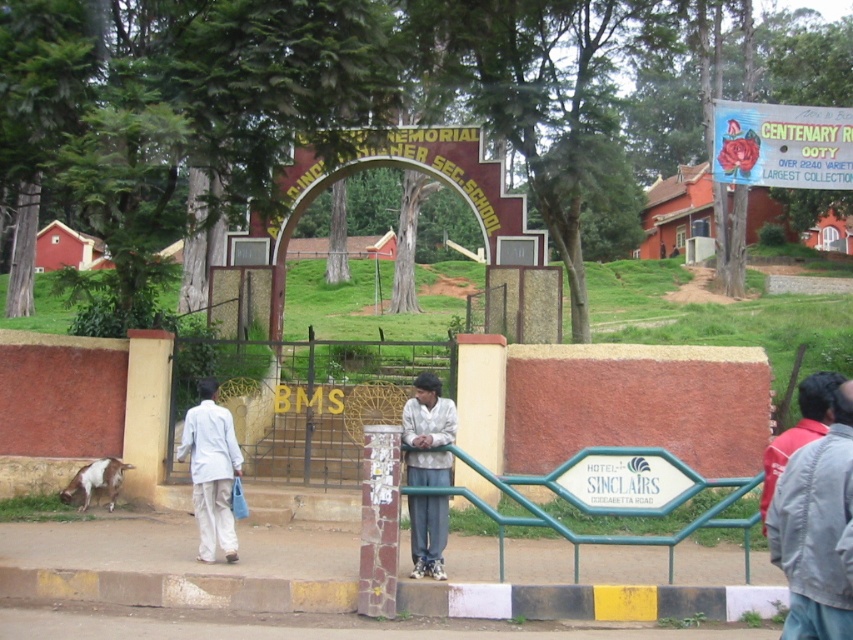
Does light beige fabric pants at center appear under white cotton shirt at left?

Incorrect, light beige fabric pants at center is not positioned below white cotton shirt at left.

Who is more distant from viewer, (424, 397) or (206, 404)?

The point (206, 404) is behind.

Is point (413, 422) closer to camera compared to point (178, 442)?

Yes, it is in front of point (178, 442).

The image size is (853, 640). I want to click on light beige fabric pants at center, so click(428, 433).

Is point (842, 472) positioned before point (195, 448)?

Yes, point (842, 472) is closer to viewer.

Does point (840, 406) come behind point (204, 483)?

No, it is in front of (204, 483).

What do you see at coordinates (816, 529) in the screenshot?
I see `gray fabric jacket at lower right` at bounding box center [816, 529].

Find the location of a particular element. gray fabric jacket at lower right is located at coordinates (816, 529).

Is metallic gate at center further to camera compared to white cotton shirt at left?

Yes, it is behind white cotton shirt at left.

The height and width of the screenshot is (640, 853). What do you see at coordinates (306, 397) in the screenshot?
I see `metallic gate at center` at bounding box center [306, 397].

Identify the location of metallic gate at center. (306, 397).